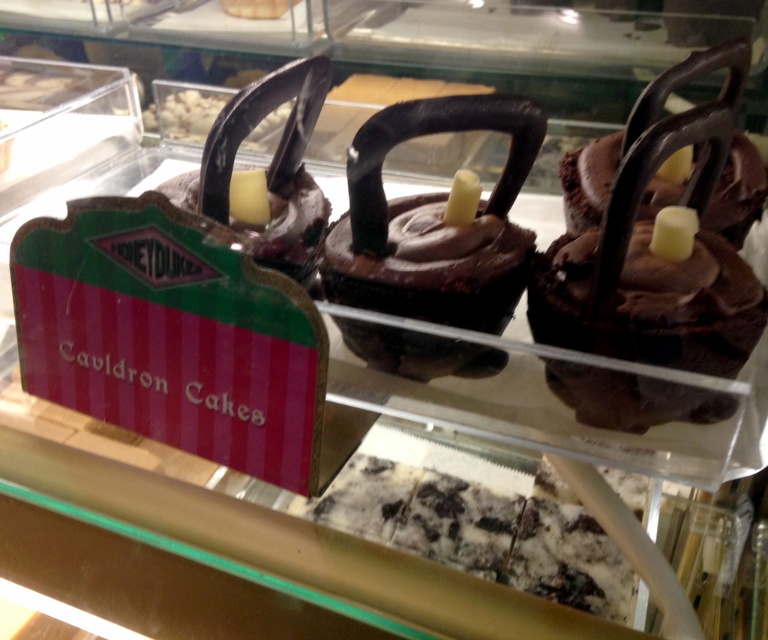
The height and width of the screenshot is (640, 768). I want to click on chocolatesmoothcupcake at center, so click(x=432, y=221).

Can you confirm if chocolatesmoothcupcake at center is positioned to the right of chocolate matte kettlebell at center?

Yes, chocolatesmoothcupcake at center is to the right of chocolate matte kettlebell at center.

Identify the location of chocolatesmoothcupcake at center. (432, 221).